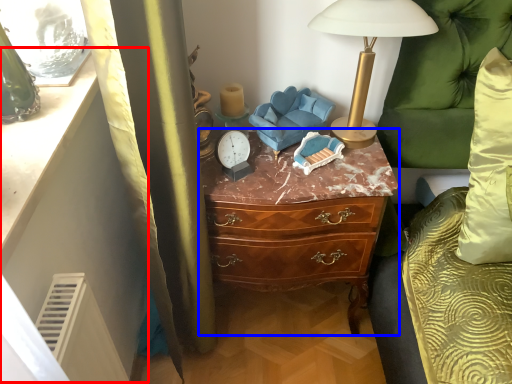
Question: Among these objects, which one is farthest to the camera, vanity (highlighted by a red box) or chest of drawers (highlighted by a blue box)?

Choices:
 (A) vanity
 (B) chest of drawers

Answer: (B)